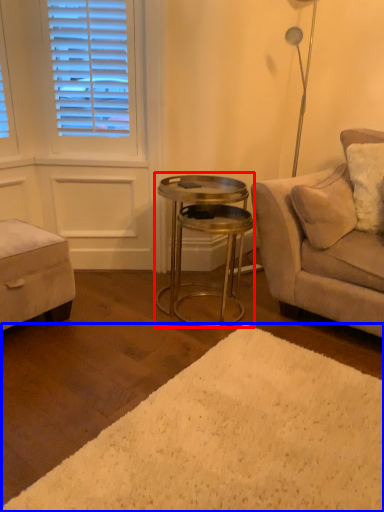
Question: Which object is further to the camera taking this photo, table (highlighted by a red box) or plain (highlighted by a blue box)?

Choices:
 (A) table
 (B) plain

Answer: (A)